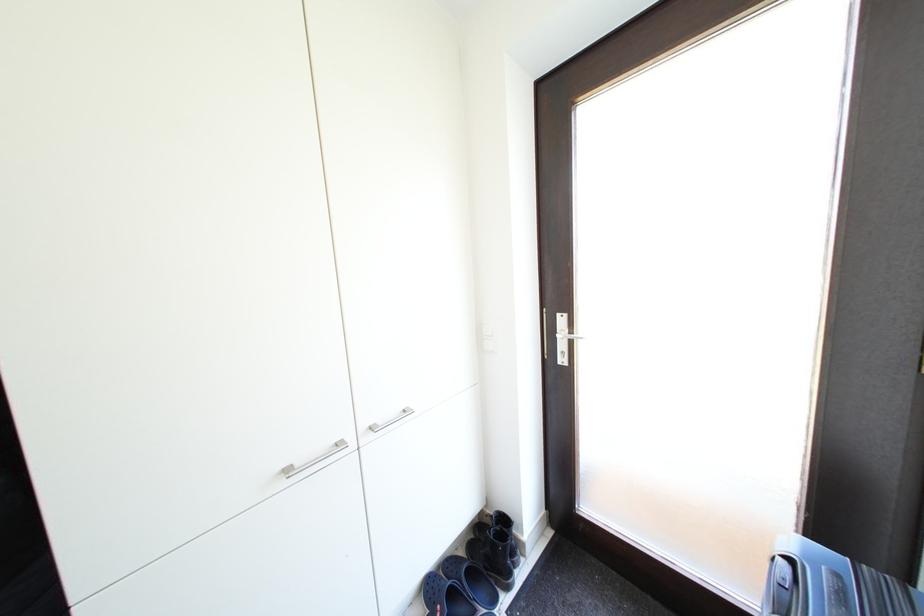
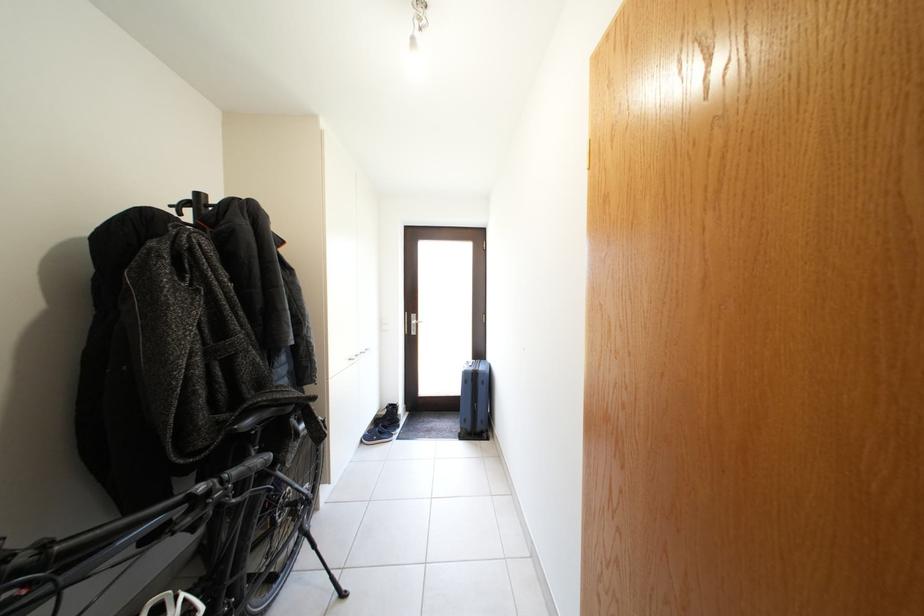
In the second image, find the point that corresponds to (569,323) in the first image.

(421, 322)